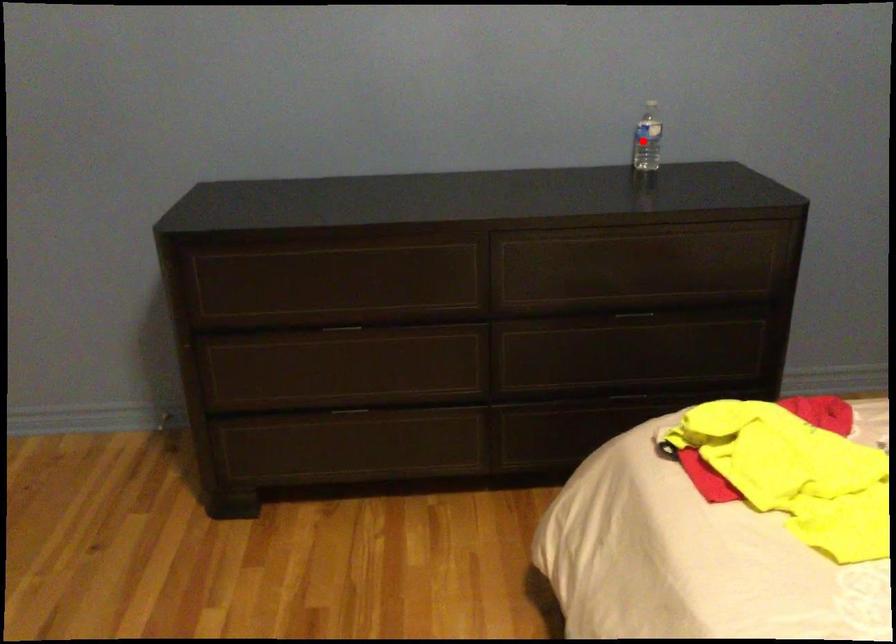
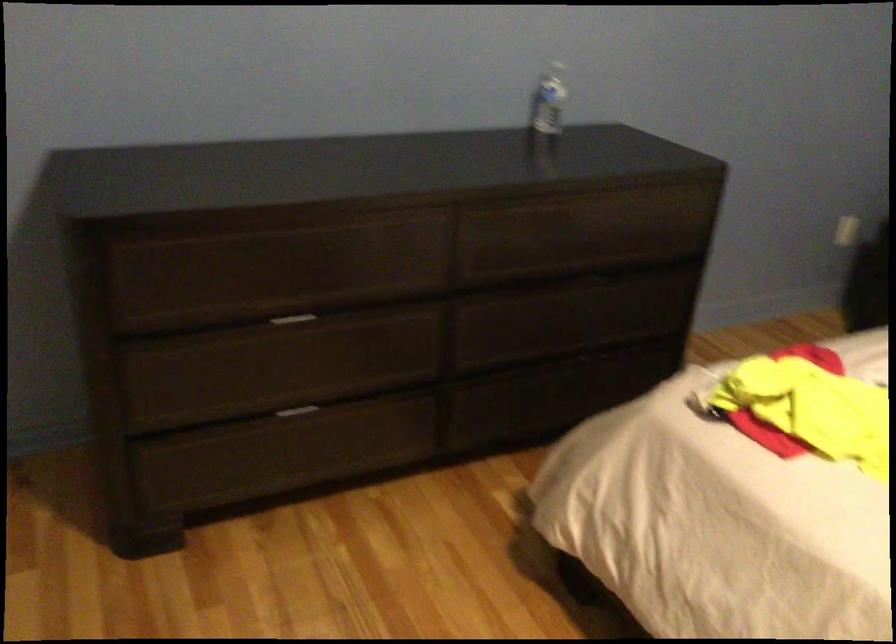
Question: I am providing you with two images of the same scene from different viewpoints. A red point is marked on the first image. Can you still see the location of the red point in image 2?

Choices:
 (A) Yes
 (B) No

Answer: (A)